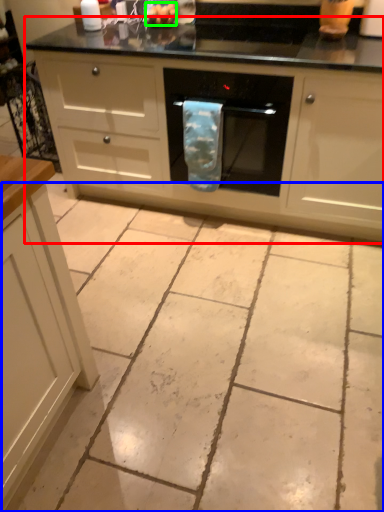
Question: Which object is positioned farthest from oven (highlighted by a red box)? Select from concrete (highlighted by a blue box) and food (highlighted by a green box).

Choices:
 (A) concrete
 (B) food

Answer: (B)